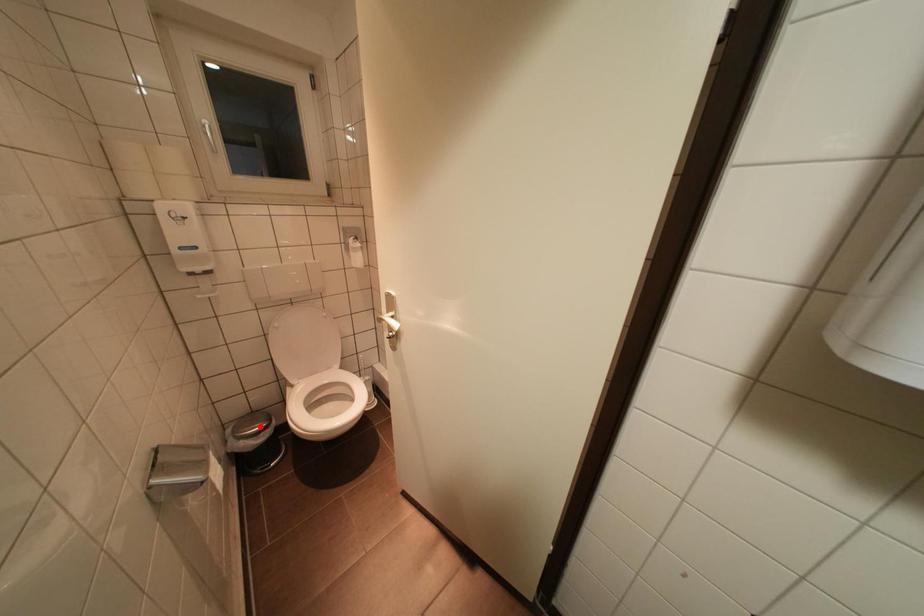
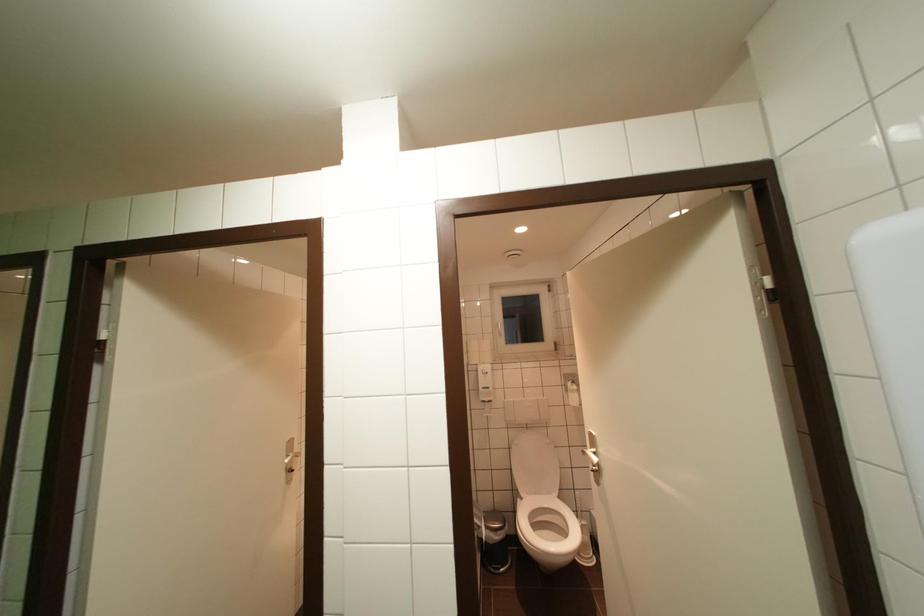
Question: A red point is marked in image1. In image2, is the corresponding 3D point closer to the camera or farther? Reply with the corresponding letter.

Choices:
 (A) The corresponding 3D point is closer.
 (B) The corresponding 3D point is farther.

Answer: (B)